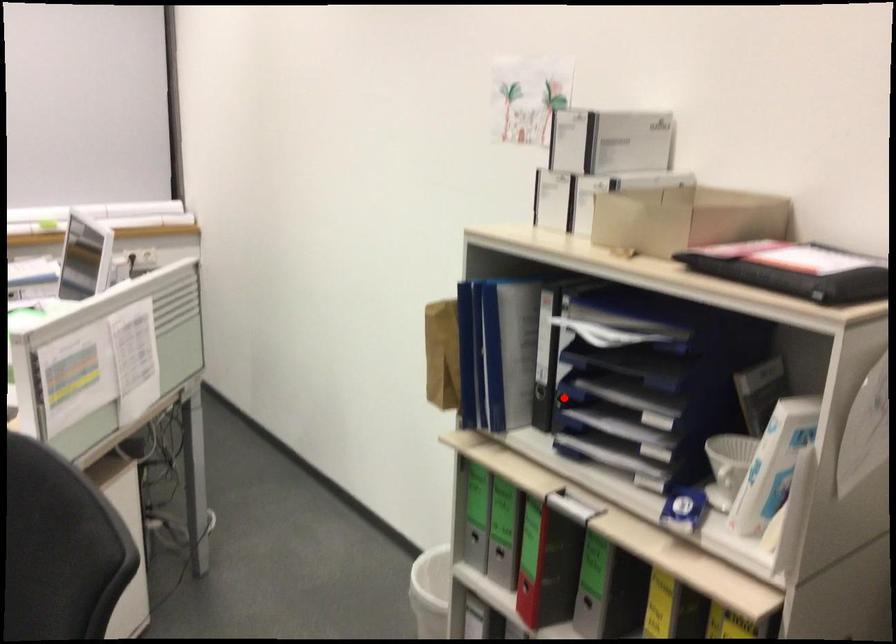
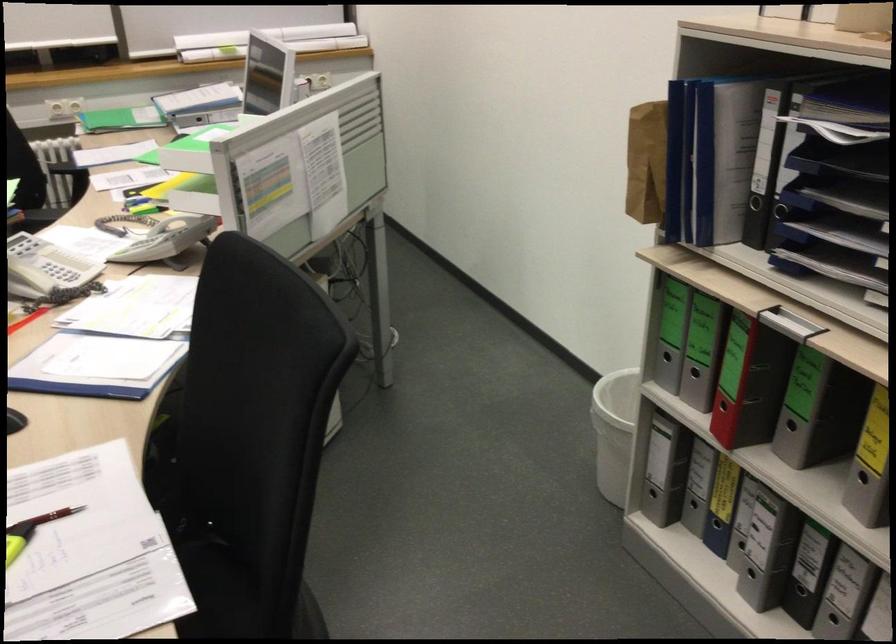
In the second image, find the point that corresponds to the highlighted location in the first image.

(779, 210)